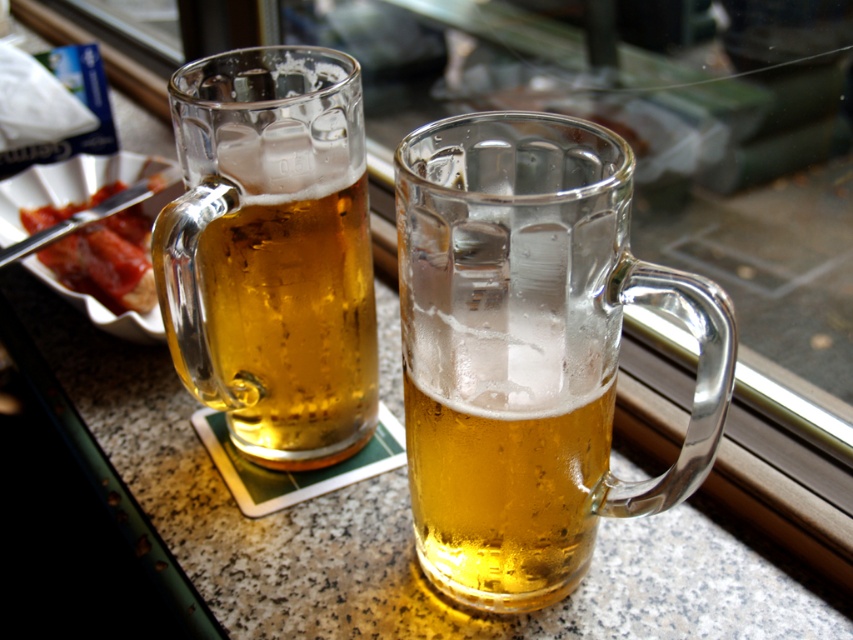
Question: Does translucent glass mug at center have a greater width compared to translucent glass mug at left?

Choices:
 (A) yes
 (B) no

Answer: (A)

Question: Is translucent glass mug at left closer to the viewer compared to slightly browned bread at left?

Choices:
 (A) no
 (B) yes

Answer: (B)

Question: Which point is farther to the camera?

Choices:
 (A) (235, 164)
 (B) (33, 230)
 (C) (461, 365)

Answer: (B)

Question: Which point is closer to the camera?

Choices:
 (A) slightly browned bread at left
 (B) translucent glass mug at left

Answer: (B)

Question: Is translucent glass mug at left further to camera compared to slightly browned bread at left?

Choices:
 (A) yes
 (B) no

Answer: (B)

Question: Which of the following is the closest to the observer?

Choices:
 (A) (146, 296)
 (B) (424, 538)

Answer: (B)